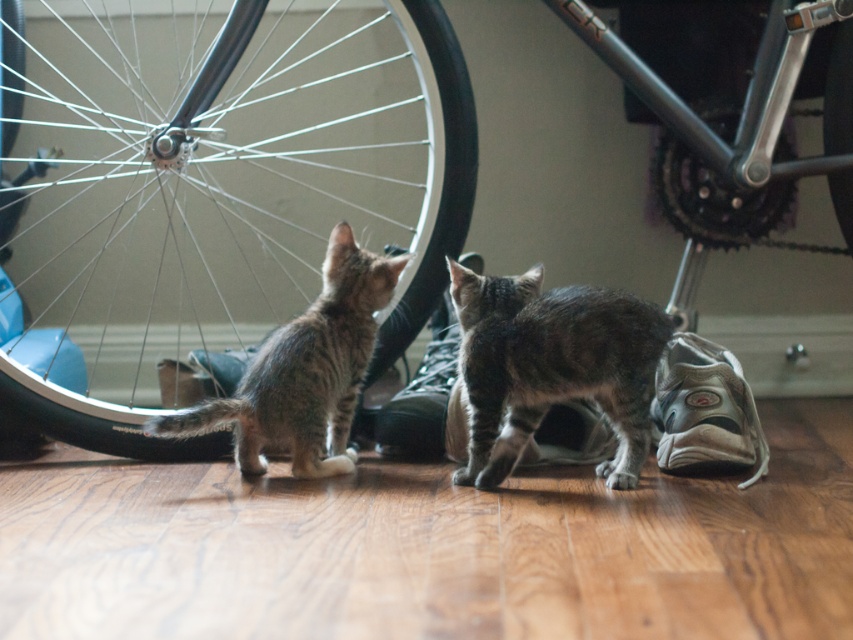
Is tabby fur kitten at center further to camera compared to brushed metal wheel at center?

No.

Consider the image. Between tabby fur kitten at center and brushed metal wheel at center, which one appears on the right side from the viewer's perspective?

From the viewer's perspective, brushed metal wheel at center appears more on the right side.

The height and width of the screenshot is (640, 853). Find the location of `tabby fur kitten at center`. tabby fur kitten at center is located at coordinates (305, 371).

The width and height of the screenshot is (853, 640). I want to click on tabby fur kitten at center, so click(x=305, y=371).

Is point (445, 416) in front of point (828, 138)?

Yes, it is.

Does black leather shoe at center appear on the left side of brushed metal wheel at center?

Yes, black leather shoe at center is to the left of brushed metal wheel at center.

This screenshot has height=640, width=853. I want to click on black leather shoe at center, so click(x=422, y=396).

Does metallic silver wheel at upper left have a lesser height compared to brushed metal wheel at center?

No.

Between point (241, 136) and point (836, 108), which one is positioned in front?

Point (836, 108)

Is point (3, 308) positioned after point (850, 115)?

Yes, it is.

Identify the location of metallic silver wheel at upper left. Image resolution: width=853 pixels, height=640 pixels. (210, 189).